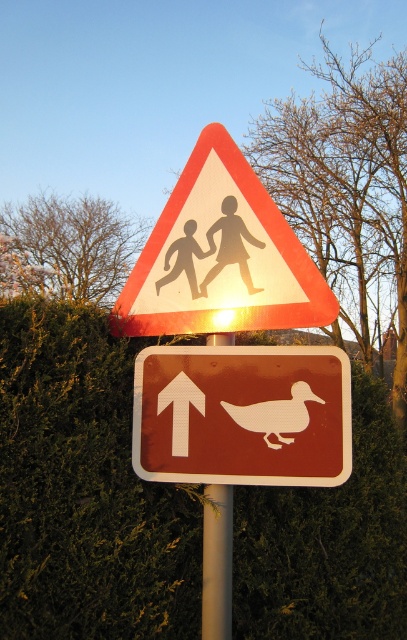
You are driving and see the two road signs on a pole. The triangular warning sign is above the rectangular one. Which sign is closer to the green leafy hedge at center located at point [85,490]?

The rectangular sign is closer to the green leafy hedge at center located at point [85,490] because it is positioned below the triangular sign, which is higher up on the pole.

You are standing at the base of the pole with the two road signs. You notice two points marked on the signs. The first point is at coordinates point (299, 572) and the second is at point (262, 188). If you want to touch both points with your finger without moving your hand, which point should you reach for first?

You should reach for point (299, 572) first because it is closer to you than point (262, 188). Since it is closer, you can touch it without moving your hand after touching the farther point.